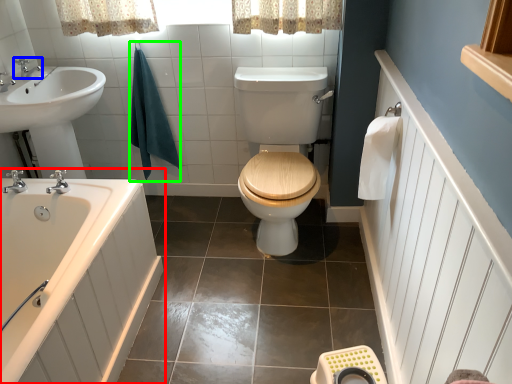
Question: Estimate the real-world distances between objects in this image. Which object is closer to bathtub (highlighted by a red box), tap (highlighted by a blue box) or bath towel (highlighted by a green box)?

Choices:
 (A) tap
 (B) bath towel

Answer: (B)